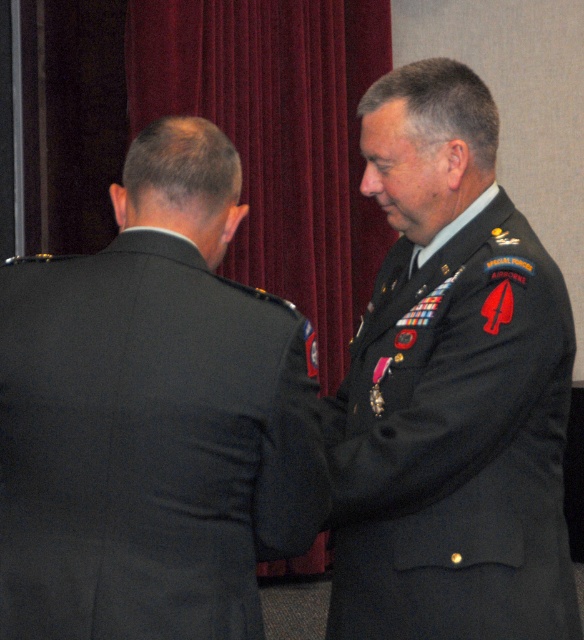
Question: Is black fabric suit at back to the right of dark green fabric military uniform at right from the viewer's perspective?

Choices:
 (A) yes
 (B) no

Answer: (B)

Question: Which is nearer to the velvet red curtain at upper center?

Choices:
 (A) dark green fabric military uniform at right
 (B) black fabric suit at back

Answer: (A)

Question: Which object is farther from the camera taking this photo?

Choices:
 (A) dark green fabric military uniform at right
 (B) black fabric suit at back
 (C) velvet red curtain at upper center

Answer: (C)

Question: In this image, where is black fabric suit at back located relative to dark green fabric military uniform at right?

Choices:
 (A) below
 (B) above

Answer: (B)

Question: Is black fabric suit at back wider than dark green fabric military uniform at right?

Choices:
 (A) yes
 (B) no

Answer: (A)

Question: Among these objects, which one is farthest from the camera?

Choices:
 (A) black fabric suit at back
 (B) dark green fabric military uniform at right
 (C) velvet red curtain at upper center

Answer: (C)